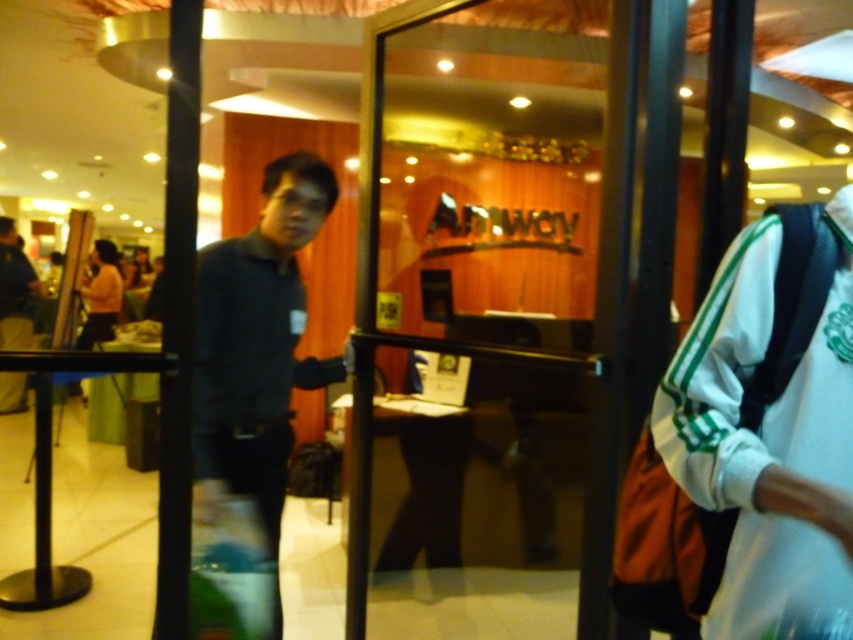
Question: Which point is closer to the camera?

Choices:
 (A) (277, 627)
 (B) (440, 428)

Answer: (A)

Question: Is transparent glass door at center thinner than dark blue shirt at center?

Choices:
 (A) no
 (B) yes

Answer: (A)

Question: Which of the following is the farthest from the observer?

Choices:
 (A) (524, 460)
 (B) (268, 557)

Answer: (A)

Question: Is transparent glass door at center to the right of dark blue shirt at center from the viewer's perspective?

Choices:
 (A) yes
 (B) no

Answer: (A)

Question: Is transparent glass door at center below dark blue shirt at center?

Choices:
 (A) no
 (B) yes

Answer: (A)